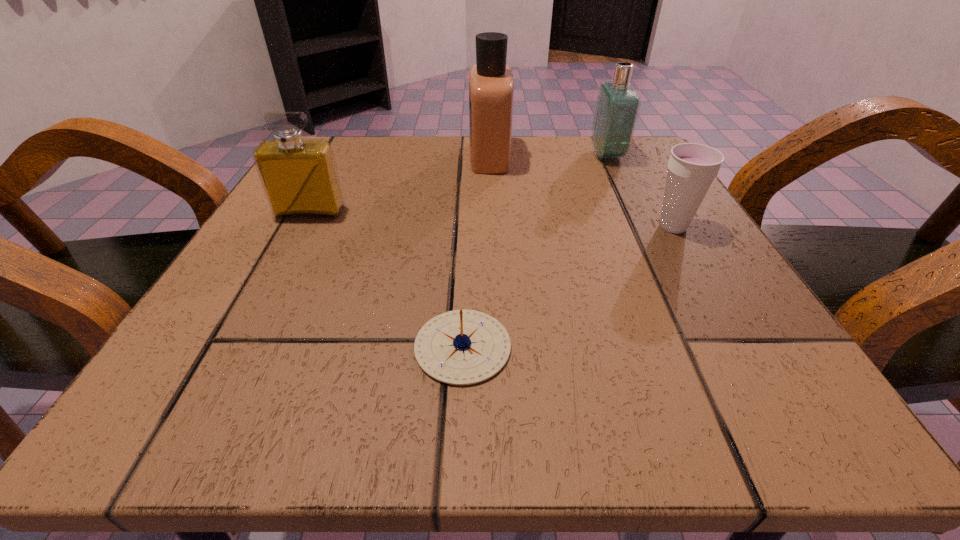
The height and width of the screenshot is (540, 960). What are the coordinates of `vacant region located on the front label of the tallest object` in the screenshot? It's located at (350, 156).

Find the location of a particular element. Image resolution: width=960 pixels, height=540 pixels. vacant space situated 0.190m on the front label of the rightmost perfume is located at coordinates (501, 155).

The width and height of the screenshot is (960, 540). In order to click on free space located 0.120m on the front label of the rightmost perfume in this screenshot , I will do (x=535, y=155).

Locate an element on the screen. free space located 0.310m on the front label of the rightmost perfume is located at coordinates (444, 155).

This screenshot has width=960, height=540. I want to click on free location located on the front-facing side of the leftmost perfume, so click(x=293, y=244).

Find the location of a particular element. The image size is (960, 540). vacant region located 0.120m on the front of the cup is located at coordinates (710, 291).

The image size is (960, 540). Find the location of `free space located 0.400m on the back of the nearest object`. free space located 0.400m on the back of the nearest object is located at coordinates (469, 169).

Find the location of a particular element. object present at the near edge is located at coordinates (461, 347).

Where is `object that is at the left edge`? This screenshot has height=540, width=960. object that is at the left edge is located at coordinates (300, 179).

Identify the location of perfume that is at the right edge. The width and height of the screenshot is (960, 540). (617, 107).